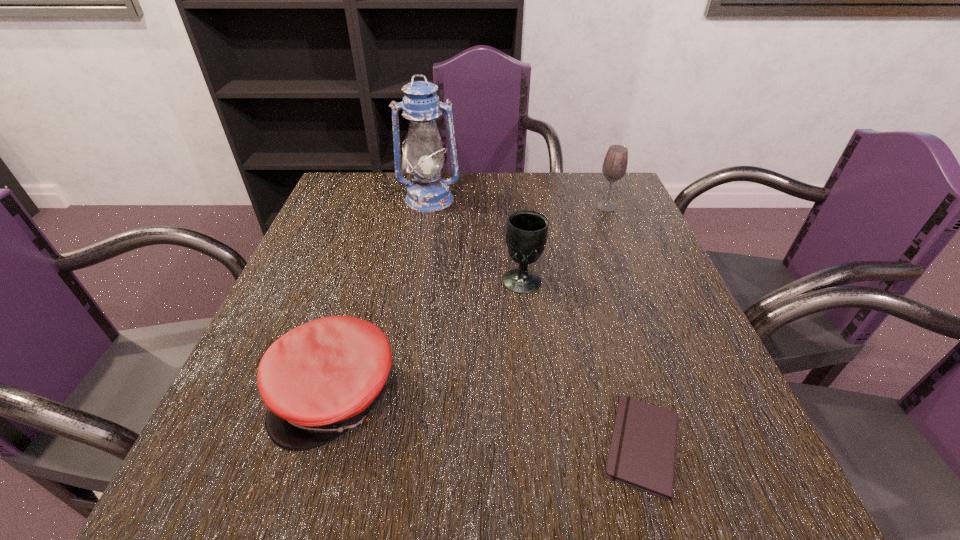
What are the coordinates of `vacant area that lies between the glass drink container and the checkbook` in the screenshot? It's located at point(625,327).

Where is `blank region between the glass drink container and the second shortest object`? The height and width of the screenshot is (540, 960). blank region between the glass drink container and the second shortest object is located at coordinates (471, 301).

Identify the location of vacant region between the shortest object and the lantern. (537, 323).

Identify the location of vacant point located between the third object from right to left and the lantern. Image resolution: width=960 pixels, height=540 pixels. (476, 240).

Find the location of `free spot between the lantern and the glass drink container`. free spot between the lantern and the glass drink container is located at coordinates (517, 203).

The width and height of the screenshot is (960, 540). Find the location of `object that is the nearest to the third object from left to right`. object that is the nearest to the third object from left to right is located at coordinates (322, 378).

Identify the location of the fourth closest object to the shortest object. (428, 192).

Where is `vacant region that satisfies the following two spatial constraints: 1. at the front of the shortest object where the visor is located; 2. on the left side of the cap`? vacant region that satisfies the following two spatial constraints: 1. at the front of the shortest object where the visor is located; 2. on the left side of the cap is located at coordinates (322, 446).

Image resolution: width=960 pixels, height=540 pixels. Identify the location of vacant position in the image that satisfies the following two spatial constraints: 1. on the front-facing side of the lantern; 2. on the right side of the shortest object. (389, 446).

What are the coordinates of `free point that satisfies the following two spatial constraints: 1. on the front-facing side of the shortest object; 2. on the right side of the lantern` in the screenshot? It's located at (389, 446).